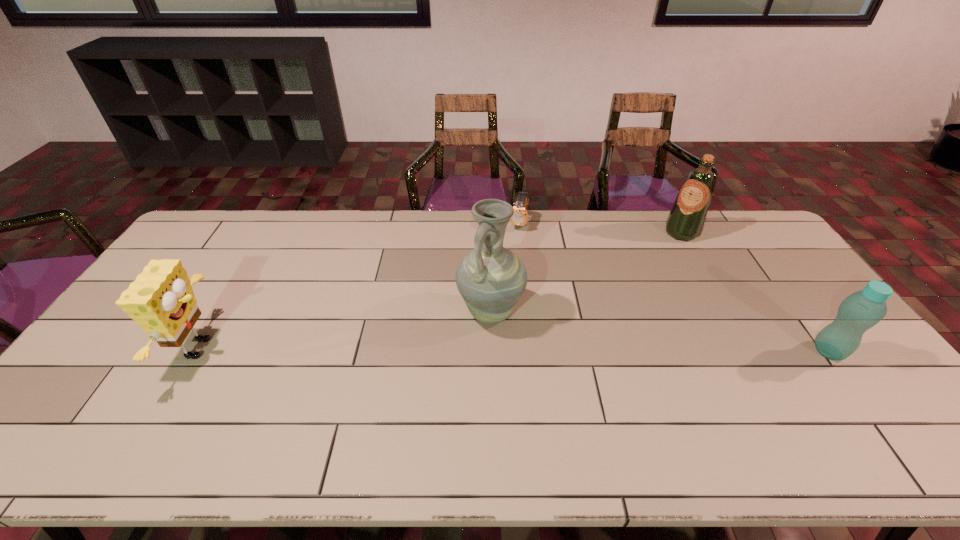
At what (x,y) coordinates should I click in order to perform the action: click on vacant space located on the front-facing side of the olive oil. Please return your answer as a coordinate pair (x, y). Image resolution: width=960 pixels, height=540 pixels. Looking at the image, I should click on (670, 247).

The image size is (960, 540). I want to click on vacant space positioned on the front-facing side of the olive oil, so click(661, 259).

Where is `vacant space located on the front-facing side of the olive oil`? The height and width of the screenshot is (540, 960). vacant space located on the front-facing side of the olive oil is located at coordinates (655, 266).

Identify the location of vacant region located 0.380m on the handle side of the pitcher. (349, 411).

Locate an element on the screen. The width and height of the screenshot is (960, 540). vacant space located 0.180m on the handle side of the pitcher is located at coordinates (416, 365).

The image size is (960, 540). I want to click on vacant space located 0.340m on the handle side of the pitcher, so click(x=364, y=402).

At what (x,y) coordinates should I click in order to perform the action: click on watch located in the far edge section of the desktop. Please return your answer as a coordinate pair (x, y). Image resolution: width=960 pixels, height=540 pixels. Looking at the image, I should click on (520, 216).

You are a GUI agent. You are given a task and a screenshot of the screen. Output one action in this format:
    pyautogui.click(x=<x>, y=<y>)
    Task: Click on the olive oil that is at the far edge
    The image size is (960, 540).
    Given the screenshot: What is the action you would take?
    pyautogui.click(x=686, y=219)

This screenshot has width=960, height=540. Identify the location of object that is at the near edge. (161, 300).

I want to click on object located in the right edge section of the desktop, so click(860, 311).